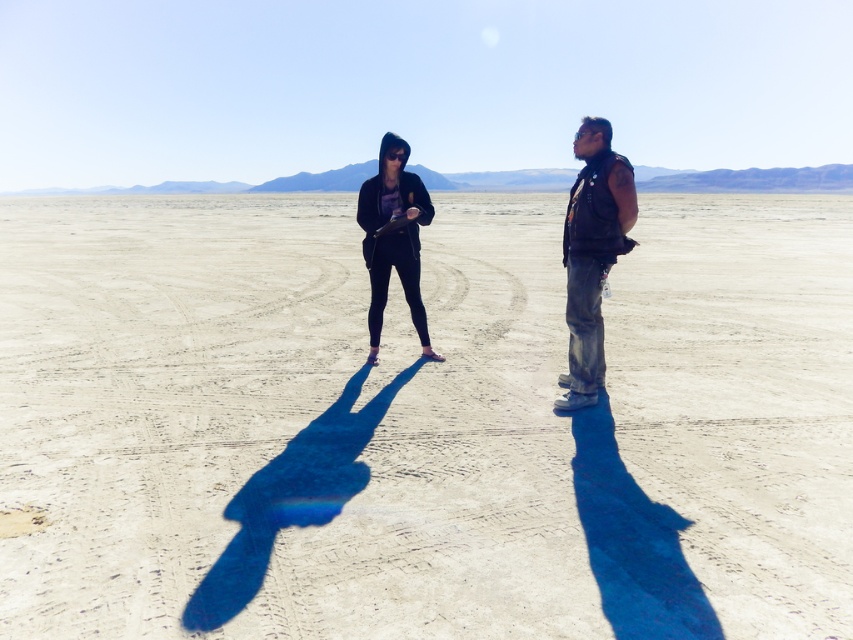
Question: Which object is farther from the camera taking this photo?

Choices:
 (A) black leather vest at right
 (B) smooth sand at center

Answer: (A)

Question: Is black leather vest at right thinner than matte black hoodie at center?

Choices:
 (A) yes
 (B) no

Answer: (A)

Question: Which of the following is the farthest from the observer?

Choices:
 (A) (424, 323)
 (B) (151, 332)

Answer: (B)

Question: Considering the relative positions of smooth sand at center and black leather vest at right in the image provided, where is smooth sand at center located with respect to black leather vest at right?

Choices:
 (A) above
 (B) below

Answer: (A)

Question: Does smooth sand at center come in front of black leather vest at right?

Choices:
 (A) yes
 (B) no

Answer: (A)

Question: Among these objects, which one is farthest from the camera?

Choices:
 (A) black leather vest at right
 (B) smooth sand at center

Answer: (A)